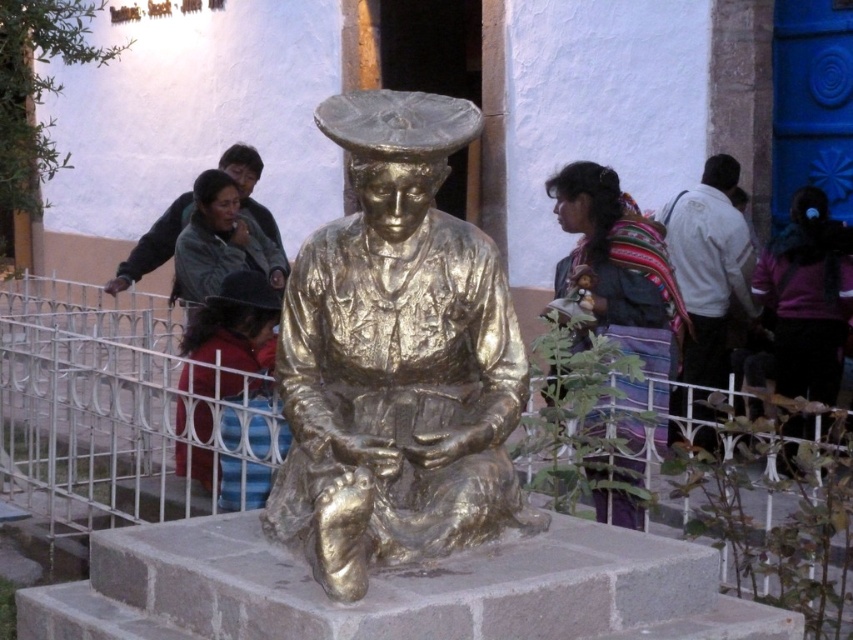
You are standing at the point marked by coordinates (396, 358) in the image. What object is located exactly at that point?

The point marked by coordinates (396, 358) is exactly where the goldbronzestatueatcenter is located.